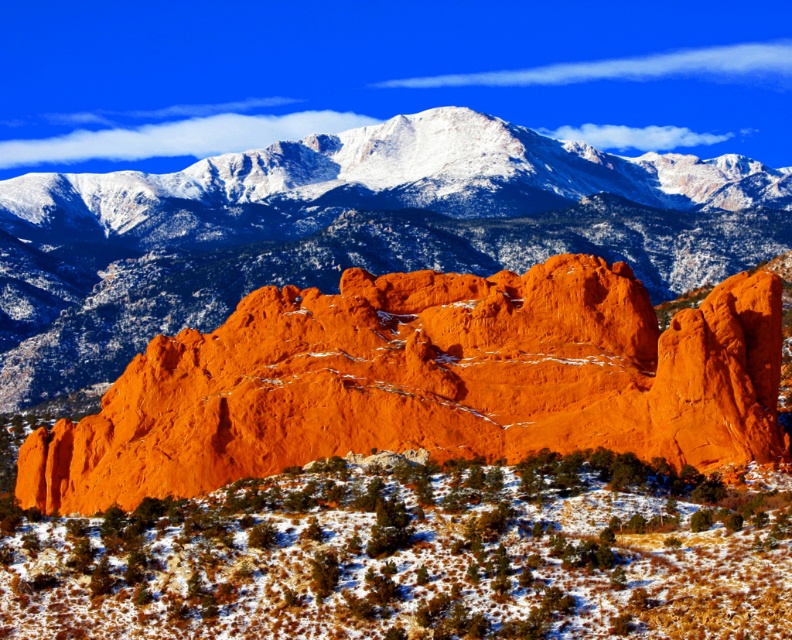
You are a GUI agent. You are given a task and a screenshot of the screen. Output one action in this format:
    pyautogui.click(x=<x>, y=<y>)
    Task: Click on the matte orange rock at center
    The width and height of the screenshot is (792, 640).
    Given the screenshot: What is the action you would take?
    pyautogui.click(x=425, y=381)

Is point (465, 369) in front of point (684, 253)?

That is True.

Locate an element on the screen. The width and height of the screenshot is (792, 640). matte orange rock at center is located at coordinates (425, 381).